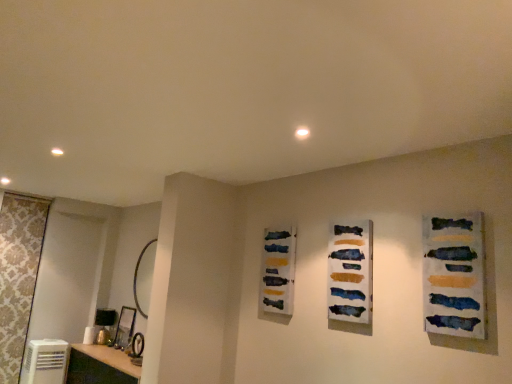
Question: Could watercolor paint strips at center, arranged as the second art when viewed from the front, be considered to be inside watercolor paint palette at center, which is counted as the 3th art, starting from the right?

Choices:
 (A) yes
 (B) no

Answer: (B)

Question: From a real-world perspective, does watercolor paint palette at center, which is counted as the 3th art, starting from the right, stand above watercolor paint strips at center, the 2th art from the left?

Choices:
 (A) yes
 (B) no

Answer: (B)

Question: Is watercolor paint palette at center, the 1th art when ordered from left to right, at the left side of watercolor paint strips at center, positioned as the second art in back-to-front order?

Choices:
 (A) yes
 (B) no

Answer: (A)

Question: From the image's perspective, would you say watercolor paint palette at center, the 1th art positioned from the back, is shown under watercolor paint strips at center, the 2th art positioned from the right?

Choices:
 (A) yes
 (B) no

Answer: (A)

Question: Considering the relative sizes of watercolor paint palette at center, which is counted as the 3th art, starting from the right, and watercolor paint strips at center, the 2th art from the left, in the image provided, is watercolor paint palette at center, which is counted as the 3th art, starting from the right, smaller than watercolor paint strips at center, the 2th art from the left,?

Choices:
 (A) yes
 (B) no

Answer: (B)

Question: Is watercolor paint palette at center, marked as the 3th art in a front-to-back arrangement, shorter than watercolor paint strips at center, arranged as the second art when viewed from the front?

Choices:
 (A) yes
 (B) no

Answer: (A)

Question: Could you tell me if white glossy vanity at lower left is turned towards watercolor paint palette at center, marked as the 3th art in a front-to-back arrangement?

Choices:
 (A) yes
 (B) no

Answer: (B)

Question: From a real-world perspective, is white glossy vanity at lower left beneath watercolor paint palette at center, which is counted as the 3th art, starting from the right?

Choices:
 (A) yes
 (B) no

Answer: (A)

Question: From the image's perspective, is white glossy vanity at lower left above watercolor paint palette at center, the 1th art positioned from the back?

Choices:
 (A) yes
 (B) no

Answer: (B)

Question: From the image's perspective, is white glossy vanity at lower left located beneath watercolor paint palette at center, marked as the 3th art in a front-to-back arrangement?

Choices:
 (A) no
 (B) yes

Answer: (B)

Question: Is there a large distance between white glossy vanity at lower left and watercolor paint palette at center, marked as the 3th art in a front-to-back arrangement?

Choices:
 (A) no
 (B) yes

Answer: (B)

Question: Is the depth of white glossy vanity at lower left greater than that of watercolor paint palette at center, the 1th art when ordered from left to right?

Choices:
 (A) yes
 (B) no

Answer: (A)

Question: Does white glossy vanity at lower left have a smaller size compared to gold metallic mirror at left?

Choices:
 (A) yes
 (B) no

Answer: (B)